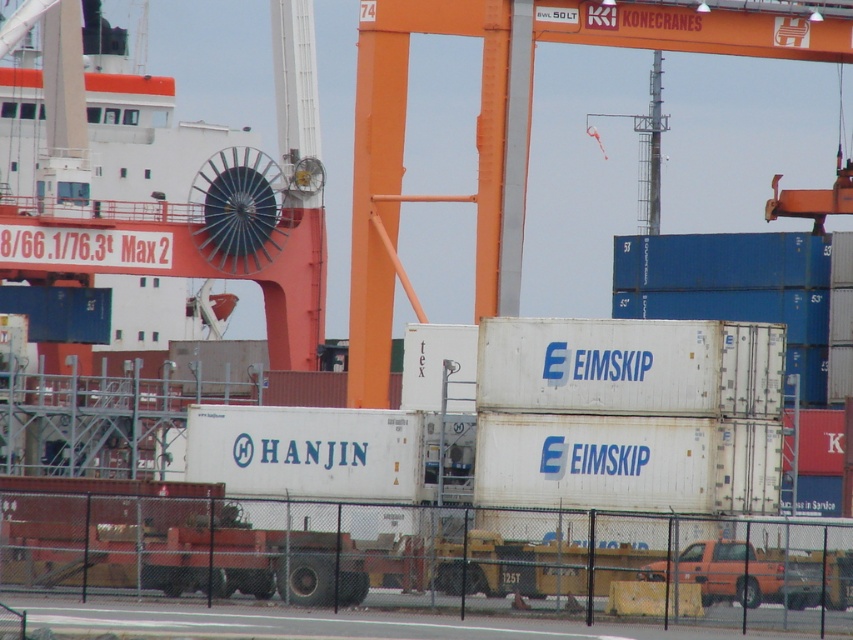
Does point (756, 10) lie behind point (753, 564)?

Yes, point (756, 10) is farther from viewer.

Find the location of a particular element. This screenshot has height=640, width=853. orange metallic crane at center is located at coordinates (506, 129).

At what (x,y) coordinates should I click in order to perform the action: click on orange metallic crane at center. Please return your answer as a coordinate pair (x, y). This screenshot has height=640, width=853. Looking at the image, I should click on (506, 129).

You are a GUI agent. You are given a task and a screenshot of the screen. Output one action in this format:
    pyautogui.click(x=<x>, y=<y>)
    Task: Click on the orange metallic crane at center
    
    Given the screenshot: What is the action you would take?
    pyautogui.click(x=506, y=129)